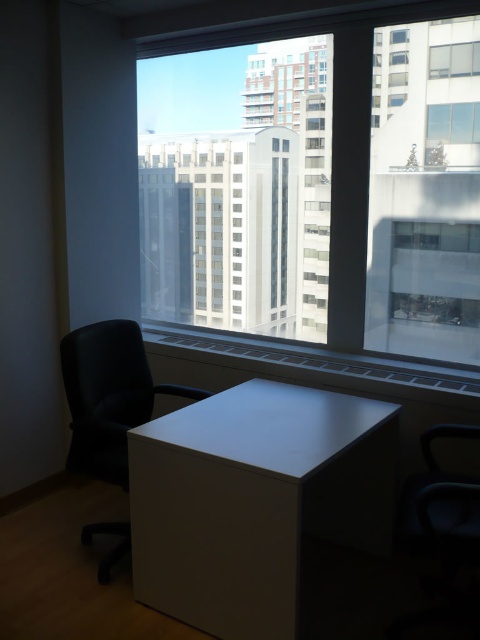
Measure the distance between point (262,136) and camera.

Point (262,136) and camera are 3.17 meters apart.

Can you confirm if transparent glass window at center is taller than white matte cabinet at center?

Yes.

In order to click on transparent glass window at center in this screenshot , I will do `click(238, 180)`.

Is transparent glass window at upper right closer to the viewer compared to transparent glass window at upper center?

No, it is behind transparent glass window at upper center.

Can you confirm if transparent glass window at upper right is taller than transparent glass window at upper center?

Yes.

The image size is (480, 640). What do you see at coordinates (454, 122) in the screenshot?
I see `transparent glass window at upper right` at bounding box center [454, 122].

Where is `transparent glass window at upper right`? Image resolution: width=480 pixels, height=640 pixels. transparent glass window at upper right is located at coordinates (454, 122).

Between black leather swivel chair at left and transparent glass window at upper right, which one appears on the right side from the viewer's perspective?

transparent glass window at upper right

Can you confirm if black leather swivel chair at left is taller than transparent glass window at upper right?

Indeed, black leather swivel chair at left has a greater height compared to transparent glass window at upper right.

You are a GUI agent. You are given a task and a screenshot of the screen. Output one action in this format:
    pyautogui.click(x=<x>, y=<y>)
    Task: Click on the black leather swivel chair at left
    The width and height of the screenshot is (480, 640).
    Given the screenshot: What is the action you would take?
    pyautogui.click(x=108, y=396)